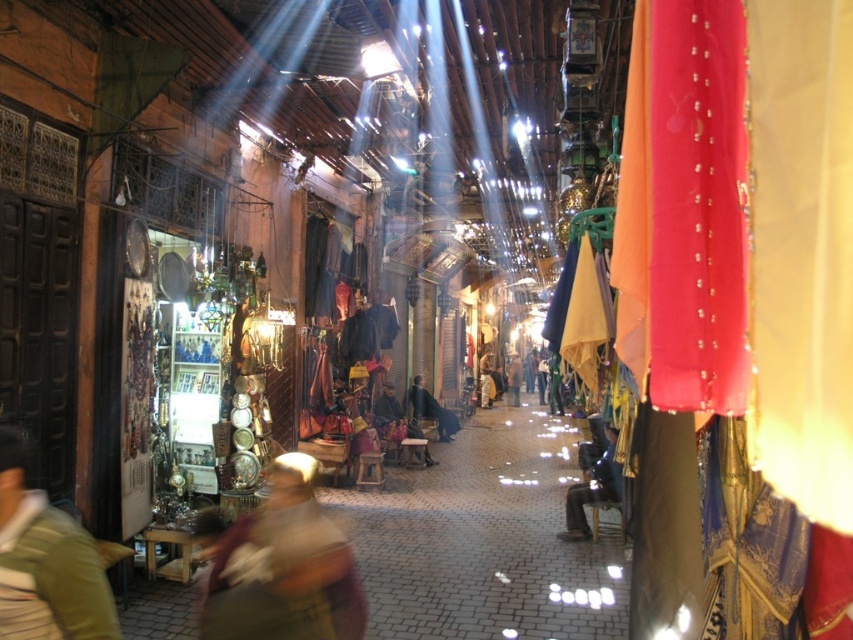
Question: Which point appears closest to the camera in this image?

Choices:
 (A) (376, 413)
 (B) (285, 592)

Answer: (B)

Question: Is light brown fabric at lower left above dark brown leather pants at center?

Choices:
 (A) no
 (B) yes

Answer: (B)

Question: Does green fabric headscarf at center have a smaller size compared to dark brown leather jacket at center?

Choices:
 (A) yes
 (B) no

Answer: (A)

Question: Which of the following is the closest to the observer?

Choices:
 (A) pos(517,396)
 (B) pos(416,388)
 (C) pos(73,636)

Answer: (C)

Question: Does light brown fabric at lower left appear over dark brown leather jacket at center?

Choices:
 (A) no
 (B) yes

Answer: (B)

Question: Which of the following is the closest to the observer?

Choices:
 (A) dark brown leather jacket at center
 (B) green fabric headscarf at center

Answer: (B)